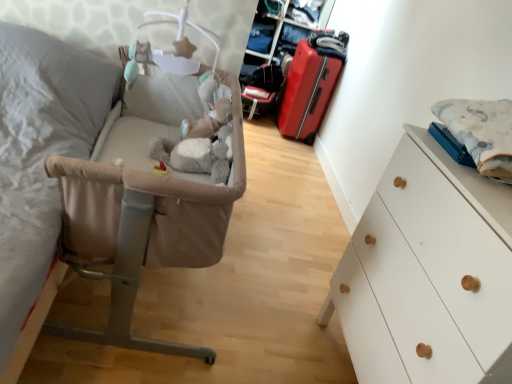
What are the coordinates of `free point in front of fluffy white blanket at right` in the screenshot? It's located at (471, 173).